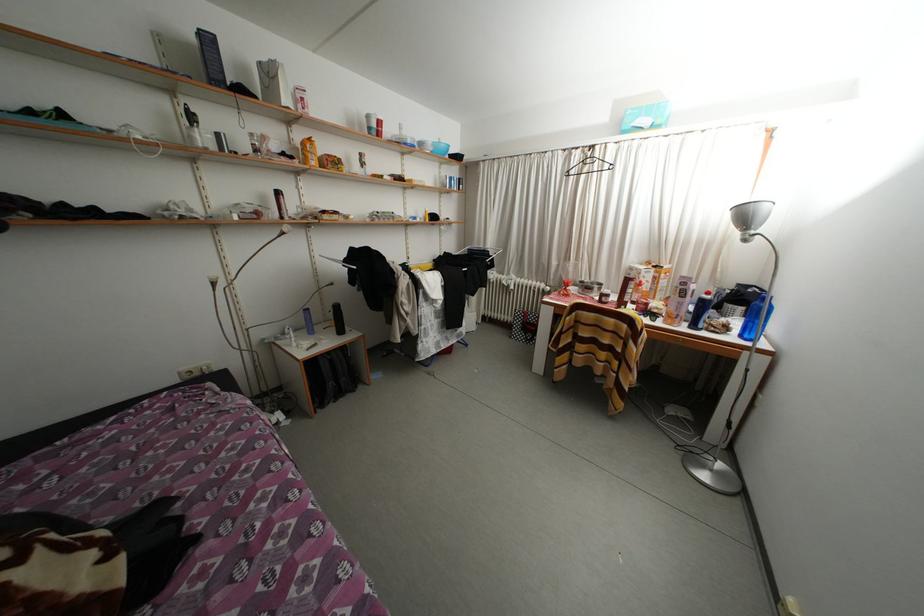
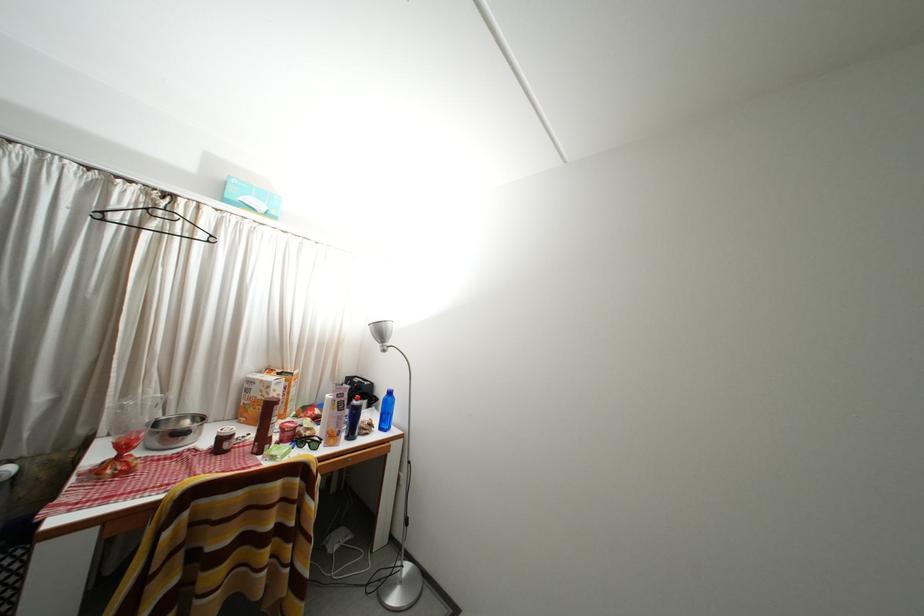
Question: The first image is from the beginning of the video and the second image is from the end. How did the camera likely rotate when shooting the video?

Choices:
 (A) Left
 (B) Right
 (C) Up
 (D) Down

Answer: (B)